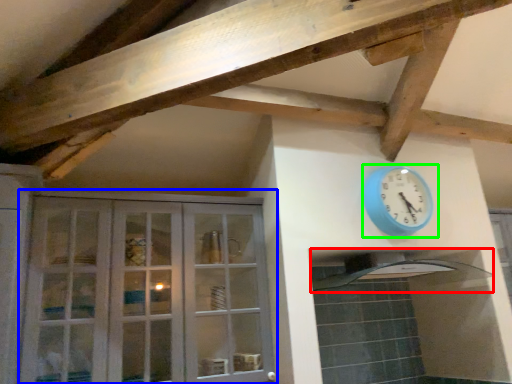
Question: Which object is the farthest from exhaust hood (highlighted by a red box)? Choose among these: cabinetry (highlighted by a blue box) or wall clock (highlighted by a green box).

Choices:
 (A) cabinetry
 (B) wall clock

Answer: (A)